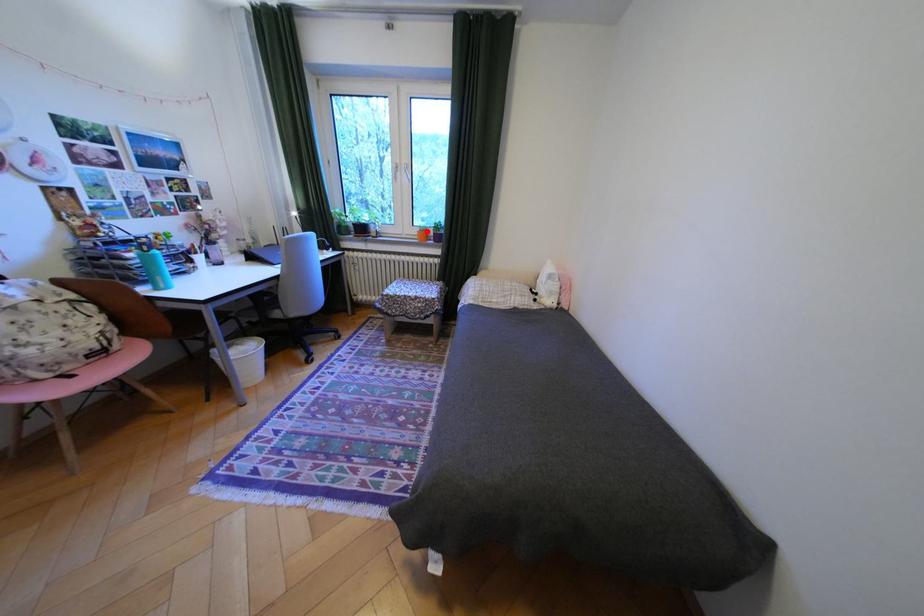
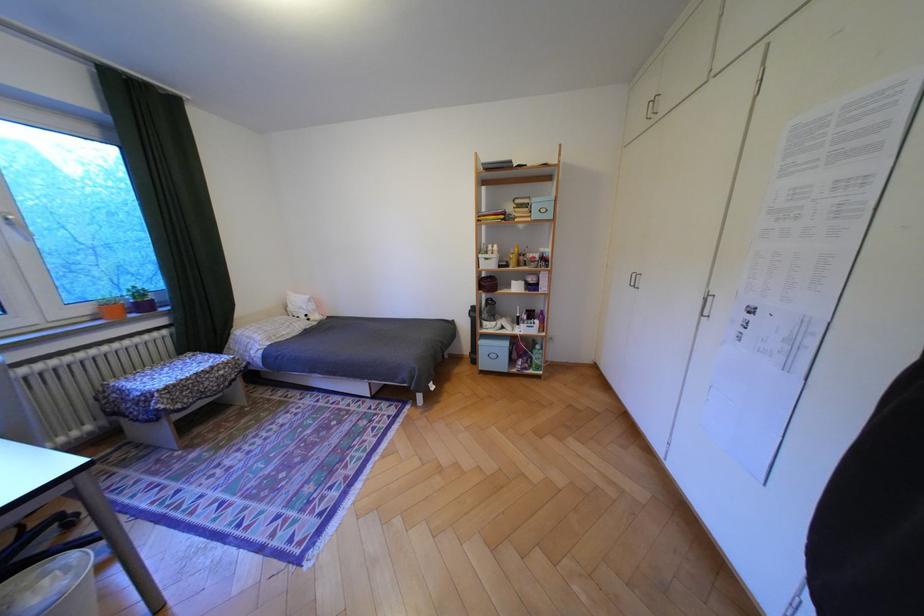
Question: A red point is marked in image1. In image2, is the corresponding 3D point closer to the camera or farther? Reply with the corresponding letter.

Choices:
 (A) The corresponding 3D point is closer.
 (B) The corresponding 3D point is farther.

Answer: (B)